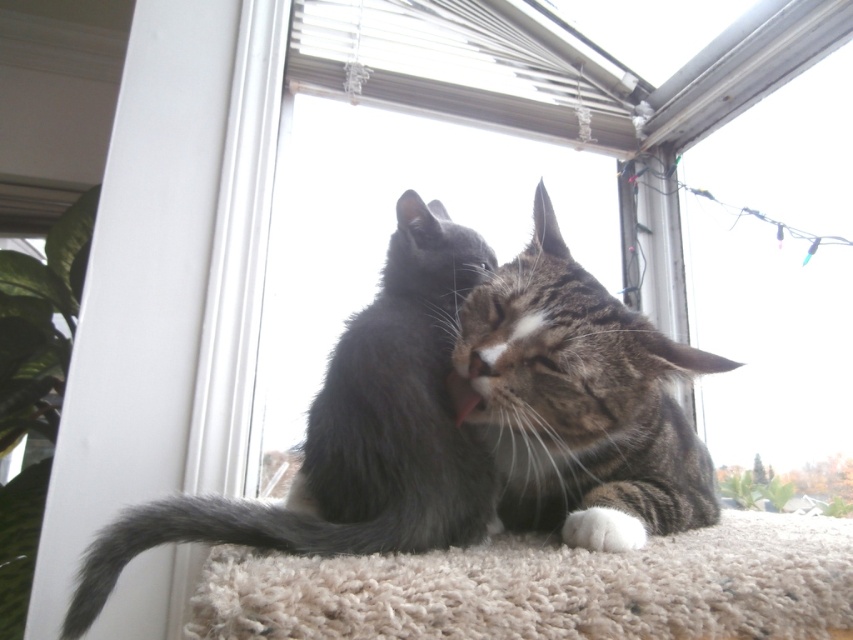
You are a pet photographer wanting to capture a closeup of both the gray fluffy cat at center and the tabby fur cat at center. Since you can only focus on one cat at a time, which cat should you choose to ensure the other remains in the background?

You should focus on the gray fluffy cat at center because it is larger and closer to the camera, making the tabby fur cat at center naturally appear in the background.

You are a photographer trying to capture a closeup of the gray fluffy cat at center and the tabby fur cat at center. Which cat will appear larger in your photo?

The gray fluffy cat at center will appear larger in the photo because it is closer to the viewer than the tabby fur cat at center.

You are a photographer wanting to capture both cats in a single frame. Since the gray fluffy cat at center and the tabby fur cat at center are positioned differently, which cat should you focus on first to ensure both are in the frame?

The gray fluffy cat at center is located above the tabby fur cat at center. To capture both in the frame, focus on the gray fluffy cat at center first as it is higher up, ensuring the lower positioned tabby fur cat at center also stays within the shot.